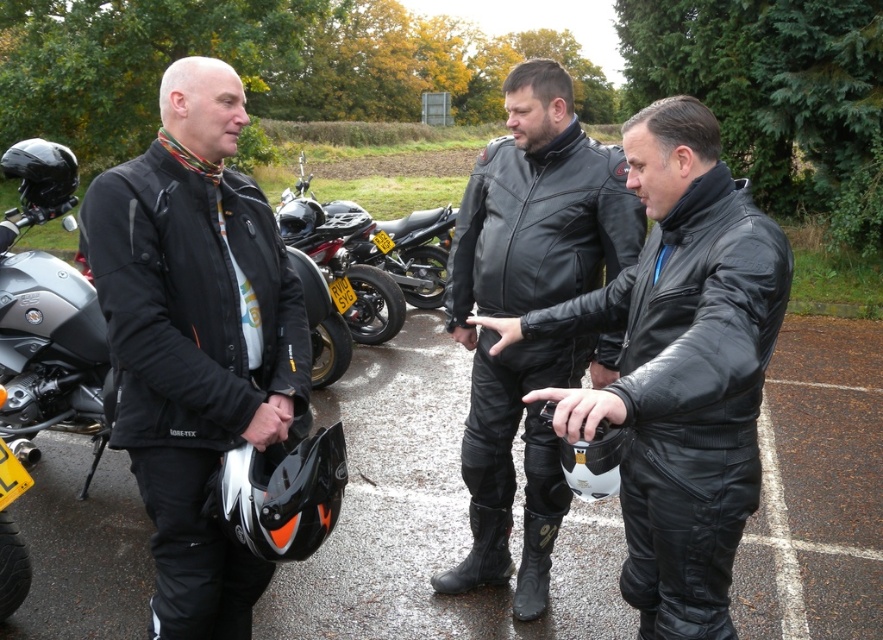
Does matte black leather jacket at center have a greater height compared to shiny black motorcycle at center?

Correct, matte black leather jacket at center is much taller as shiny black motorcycle at center.

How far apart are matte black leather jacket at center and shiny black motorcycle at center?

15.69 feet

This screenshot has width=883, height=640. I want to click on matte black leather jacket at center, so click(x=678, y=369).

Is point (636, 268) closer to viewer compared to point (540, 385)?

Yes, it is in front of point (540, 385).

Does matte black leather jacket at center lie in front of black leather jacket at center?

Yes.

Is point (653, 636) less distant than point (589, 234)?

Yes, it is.

Identify the location of matte black leather jacket at center. (678, 369).

Does matte black leather jacket at center appear on the right side of black leather motorcycle at center?

Correct, you'll find matte black leather jacket at center to the right of black leather motorcycle at center.

Where is `matte black leather jacket at center`? This screenshot has width=883, height=640. matte black leather jacket at center is located at coordinates (678, 369).